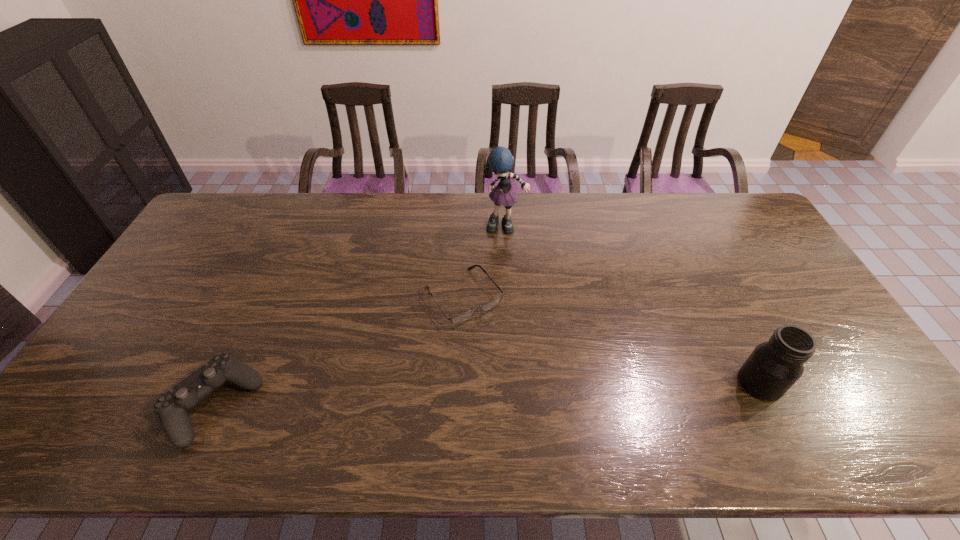
Locate an element on the screen. This screenshot has height=540, width=960. vacant space located on the front-facing side of the spectacles is located at coordinates (523, 373).

Where is `vacant space located 0.190m on the front-facing side of the spectacles`? The height and width of the screenshot is (540, 960). vacant space located 0.190m on the front-facing side of the spectacles is located at coordinates (523, 373).

Where is `free space located 0.300m on the front-facing side of the spectacles`? This screenshot has height=540, width=960. free space located 0.300m on the front-facing side of the spectacles is located at coordinates (549, 407).

Locate an element on the screen. The image size is (960, 540). free space located 0.130m on the front-facing side of the rag doll is located at coordinates (513, 262).

Where is `vacant space situated on the front-facing side of the rag doll`? This screenshot has height=540, width=960. vacant space situated on the front-facing side of the rag doll is located at coordinates pos(520,302).

Image resolution: width=960 pixels, height=540 pixels. Identify the location of vacant space located 0.320m on the front-facing side of the rag doll. (521, 307).

Where is `object at the far edge`? This screenshot has height=540, width=960. object at the far edge is located at coordinates (501, 161).

I want to click on control present at the near edge, so click(x=172, y=407).

This screenshot has height=540, width=960. What are the coordinates of `jar positioned at the near edge` in the screenshot? It's located at (774, 366).

You are a GUI agent. You are given a task and a screenshot of the screen. Output one action in this format:
    pyautogui.click(x=<x>, y=<y>)
    Task: Click on the vacant region at the far edge of the desktop
    
    Given the screenshot: What is the action you would take?
    pyautogui.click(x=419, y=219)